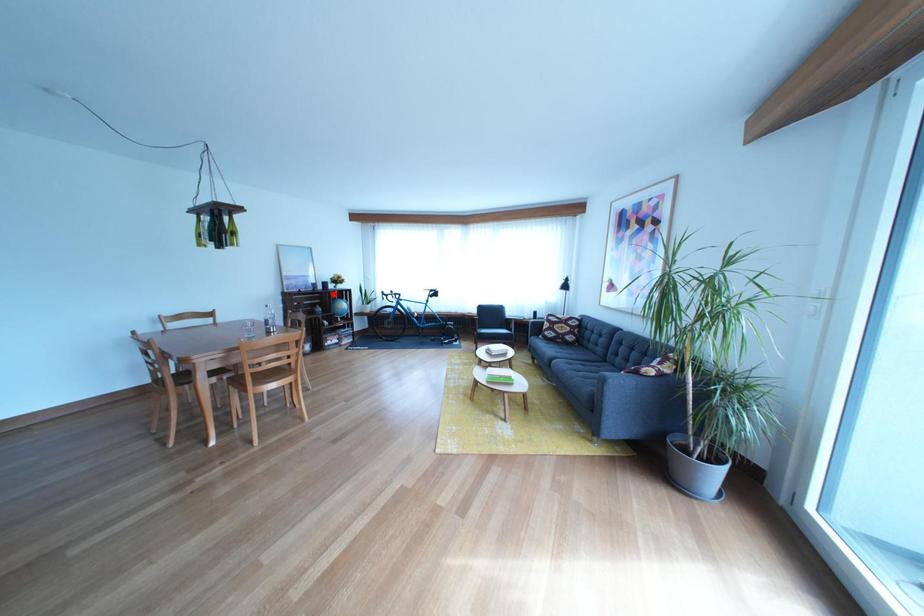
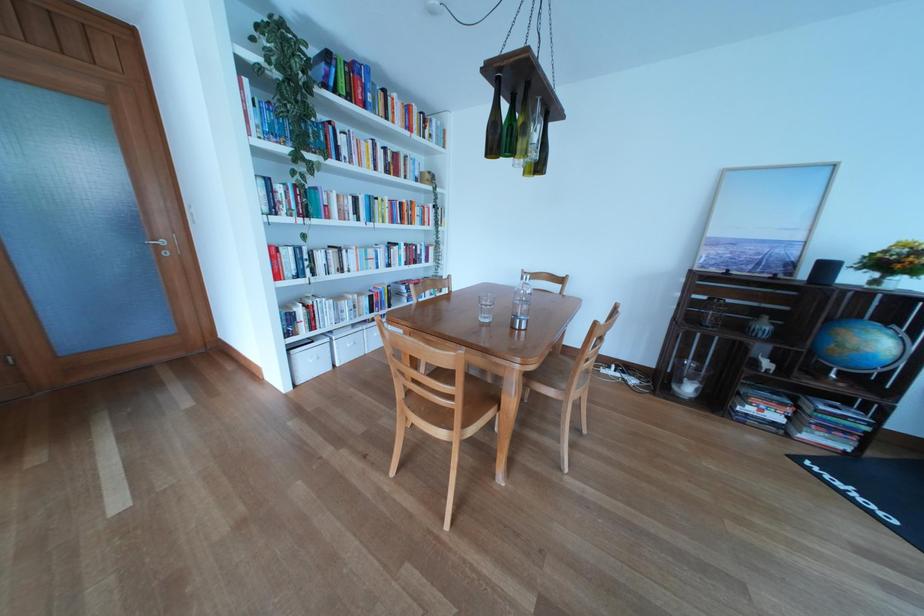
Find the pixel in the second image that matches the highlighted location in the first image.

(816, 282)